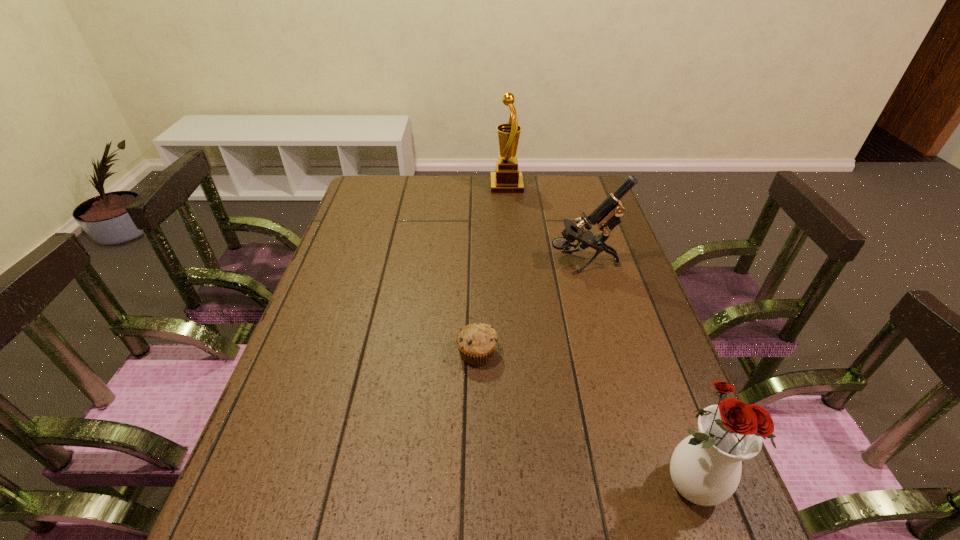
You are a GUI agent. You are given a task and a screenshot of the screen. Output one action in this format:
    pyautogui.click(x=<x>, y=<y>)
    Task: Click on the vacant space located through the eyepiece of the microscope
    The width and height of the screenshot is (960, 540).
    Given the screenshot: What is the action you would take?
    pyautogui.click(x=496, y=263)

Where is `free spot located through the eyepiece of the microscope`? This screenshot has height=540, width=960. free spot located through the eyepiece of the microscope is located at coordinates (441, 263).

Find the location of `vacant area situated 0.380m on the left of the nearest object`. vacant area situated 0.380m on the left of the nearest object is located at coordinates 454,485.

Where is `blank area located 0.280m on the left of the second nearest object`? This screenshot has height=540, width=960. blank area located 0.280m on the left of the second nearest object is located at coordinates (342, 353).

The image size is (960, 540). Identify the location of object positioned at the far edge. (507, 179).

You are a GUI agent. You are given a task and a screenshot of the screen. Output one action in this format:
    pyautogui.click(x=<x>, y=<y>)
    Task: Click on the microscope at the right edge
    
    Given the screenshot: What is the action you would take?
    pyautogui.click(x=606, y=216)

Locate an element on the screen. Image resolution: width=960 pixels, height=540 pixels. vase that is at the right edge is located at coordinates (705, 467).

This screenshot has width=960, height=540. In the image, there is a desktop. Find the location of `vacant space at the far edge`. vacant space at the far edge is located at coordinates (533, 194).

In the image, there is a desktop. At what (x,y) coordinates should I click in order to perform the action: click on vacant space at the left edge. Please return your answer as a coordinate pair (x, y). The image size is (960, 540). Looking at the image, I should click on (329, 342).

In the image, there is a desktop. Identify the location of vacant space at the right edge. (656, 362).